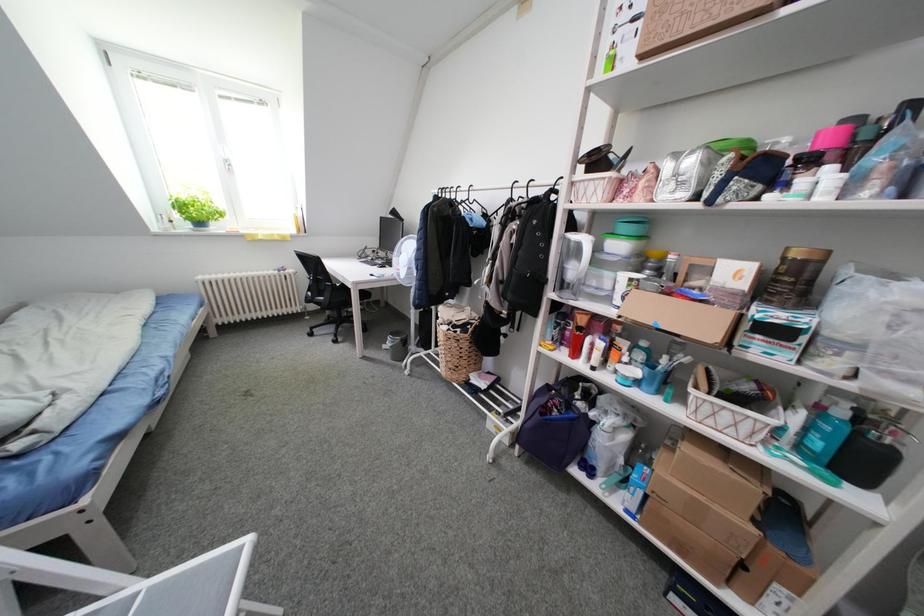
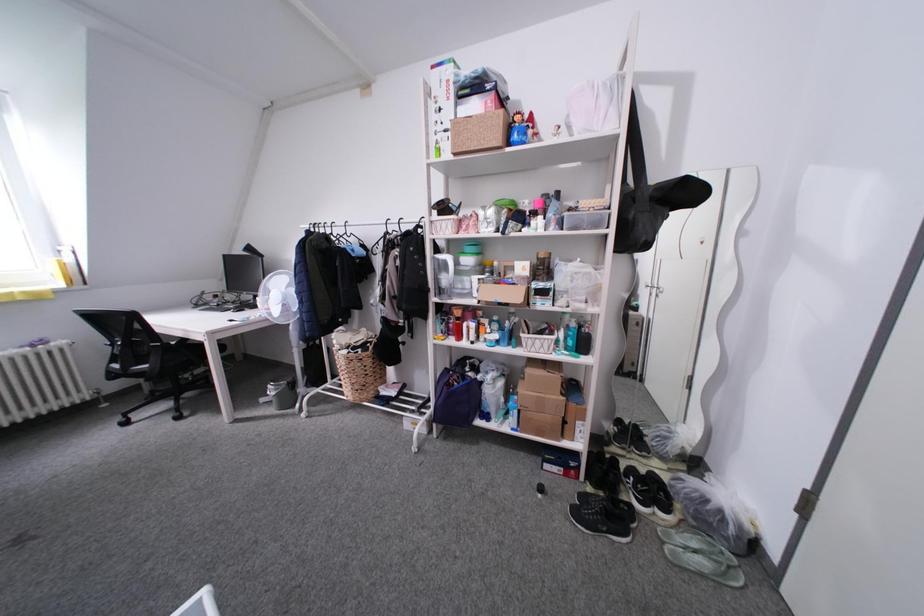
Question: The camera is either moving clockwise (left) or counter-clockwise (right) around the object. The first image is from the beginning of the video and the second image is from the end. Is the camera moving left or right when shooting the video?

Choices:
 (A) Left
 (B) Right

Answer: (A)